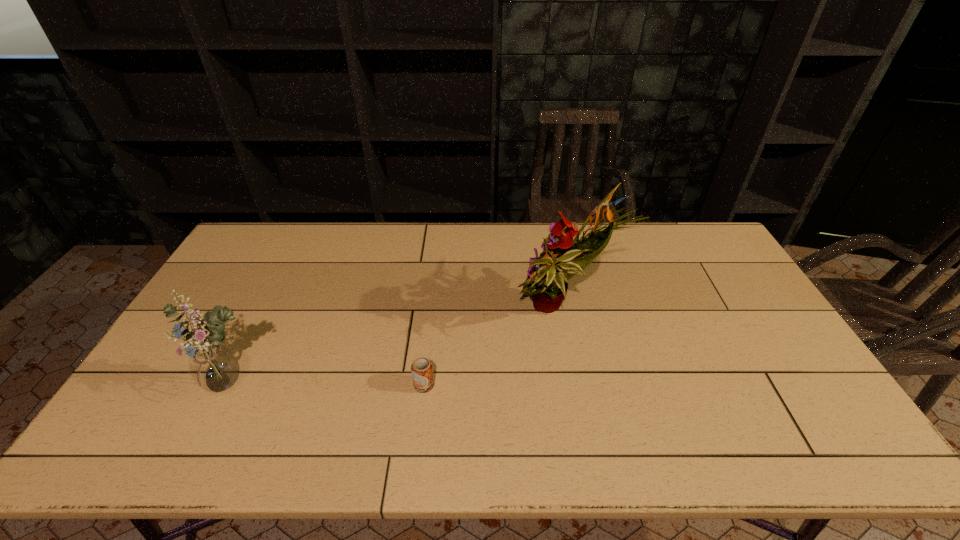
Find the location of a particular element. The width and height of the screenshot is (960, 540). free location located on the front of the second object from right to left is located at coordinates tap(420, 418).

Image resolution: width=960 pixels, height=540 pixels. Find the location of `object that is positioned at the left edge`. object that is positioned at the left edge is located at coordinates (214, 368).

Locate an element on the screen. This screenshot has height=540, width=960. free space at the far edge of the desktop is located at coordinates (391, 231).

The image size is (960, 540). Find the location of `vacant area at the near edge`. vacant area at the near edge is located at coordinates (x=363, y=447).

In the image, there is a desktop. At what (x,y) coordinates should I click in order to perform the action: click on vacant area at the right edge. Please return your answer as a coordinate pair (x, y). Image resolution: width=960 pixels, height=540 pixels. Looking at the image, I should click on (780, 379).

Locate an element on the screen. The width and height of the screenshot is (960, 540). free region at the far left corner of the desktop is located at coordinates (244, 246).

In the image, there is a desktop. Identify the location of free region at the near right corner. (841, 447).

In order to click on unoccupied position between the shorter bouquet and the farther bouquet in this screenshot , I will do `click(397, 349)`.

In order to click on free space between the nearer bouquet and the second object from left to right in this screenshot , I will do `click(328, 385)`.

Find the location of `free spot between the shorter bouquet and the farthest object`. free spot between the shorter bouquet and the farthest object is located at coordinates (397, 349).